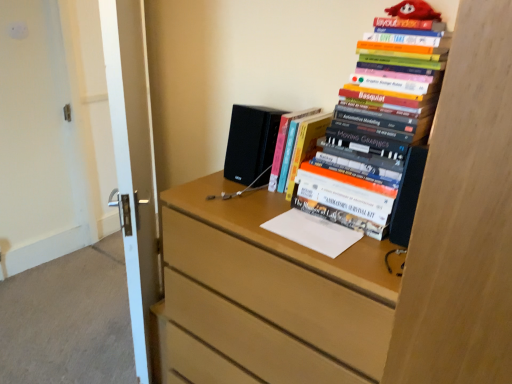
What do you see at coordinates (306, 274) in the screenshot? I see `light wood chest of drawers at center` at bounding box center [306, 274].

Image resolution: width=512 pixels, height=384 pixels. I want to click on hardcover book at center, placed as the second book when sorted from right to left, so click(x=296, y=146).

Based on the photo, measure the distance between point (303, 196) and camera.

1.24 meters.

Locate an element on the screen. The height and width of the screenshot is (384, 512). light wood chest of drawers at center is located at coordinates (306, 274).

Between point (293, 139) and point (151, 163), which one is positioned in front?

The point (293, 139) is closer.

From the image's perspective, is hardcover book at center, placed as the 1th book when sorted from left to right, under white glossy door at left?

No, from the image's perspective, hardcover book at center, placed as the 1th book when sorted from left to right, is not beneath white glossy door at left.

Is hardcover book at center, placed as the 1th book when sorted from left to right, positioned with its back to white glossy door at left?

No, white glossy door at left is not at the back of hardcover book at center, placed as the 1th book when sorted from left to right.

How many degrees apart are the facing directions of hardcover book at center, placed as the second book when sorted from right to left, and white glossy door at left?

44 degrees separate the facing orientations of hardcover book at center, placed as the second book when sorted from right to left, and white glossy door at left.

The width and height of the screenshot is (512, 384). Identify the location of chest of drawers that appears on the right of white glossy door at left. (306, 274).

Is white glossy door at left aimed at light wood chest of drawers at center?

No, white glossy door at left is not facing towards light wood chest of drawers at center.

Between white glossy door at left and light wood chest of drawers at center, which one is positioned in front?

light wood chest of drawers at center is in front.

Considering the sizes of objects black matte speaker at center and hardcover books at upper right, the second book viewed from the left, in the image provided, who is smaller, black matte speaker at center or hardcover books at upper right, the second book viewed from the left,?

black matte speaker at center.

Is there a large distance between black matte speaker at center and hardcover books at upper right, the 1th book from the right?

No, black matte speaker at center is not far away from hardcover books at upper right, the 1th book from the right.

Is the depth of black matte speaker at center less than that of hardcover books at upper right, the second book viewed from the left?

No, it is not.

Find the location of a particular element. This screenshot has height=384, width=512. speaker that appears below the hardcover books at upper right, the second book viewed from the left (from a real-world perspective) is located at coordinates (251, 142).

Can you see hardcover books at upper right, the 1th book from the right, touching hardcover book at center, placed as the second book when sorted from right to left?

No, hardcover books at upper right, the 1th book from the right, is not making contact with hardcover book at center, placed as the second book when sorted from right to left.

Which of these two, hardcover books at upper right, the second book viewed from the left, or hardcover book at center, placed as the second book when sorted from right to left, is bigger?

With larger size is hardcover books at upper right, the second book viewed from the left.

Considering the relative sizes of hardcover books at upper right, the second book viewed from the left, and hardcover book at center, placed as the second book when sorted from right to left, in the image provided, is hardcover books at upper right, the second book viewed from the left, wider than hardcover book at center, placed as the second book when sorted from right to left,?

Yes, hardcover books at upper right, the second book viewed from the left, is wider than hardcover book at center, placed as the second book when sorted from right to left.

Considering the points (145, 73) and (307, 145), which point is in front, point (145, 73) or point (307, 145)?

The point (307, 145) is more forward.

Relative to hardcover book at center, placed as the second book when sorted from right to left, is white glossy door at left in front or behind?

Clearly, white glossy door at left is in front of hardcover book at center, placed as the second book when sorted from right to left.

From the image's perspective, would you say white glossy door at left is positioned over hardcover book at center, placed as the second book when sorted from right to left?

Incorrect, from the image's perspective, white glossy door at left is lower than hardcover book at center, placed as the second book when sorted from right to left.

Locate an element on the screen. book that appears behind the white glossy door at left is located at coordinates (296, 146).

In the image, is hardcover books at upper right, the second book viewed from the left, on the left side or the right side of light wood chest of drawers at center?

From the image, it's evident that hardcover books at upper right, the second book viewed from the left, is to the right of light wood chest of drawers at center.

In the scene shown: Is hardcover books at upper right, the second book viewed from the left, oriented away from light wood chest of drawers at center?

No, hardcover books at upper right, the second book viewed from the left,'s orientation is not away from light wood chest of drawers at center.

Is hardcover books at upper right, the second book viewed from the left, inside or outside of light wood chest of drawers at center?

hardcover books at upper right, the second book viewed from the left, cannot be found inside light wood chest of drawers at center.

Are hardcover books at upper right, the 1th book from the right, and light wood chest of drawers at center far apart?

No, hardcover books at upper right, the 1th book from the right, is in close proximity to light wood chest of drawers at center.

Which of these two, black matte speaker at center or hardcover book at center, placed as the 1th book when sorted from left to right, is thinner?

black matte speaker at center is thinner.

Is black matte speaker at center aimed at hardcover book at center, placed as the second book when sorted from right to left?

No, black matte speaker at center is not facing towards hardcover book at center, placed as the second book when sorted from right to left.

Is the depth of black matte speaker at center greater than that of hardcover book at center, placed as the 1th book when sorted from left to right?

Yes.

Is black matte speaker at center next to hardcover book at center, placed as the second book when sorted from right to left, and touching it?

Indeed, black matte speaker at center and hardcover book at center, placed as the second book when sorted from right to left, are beside each other and touching.

Locate an element on the screen. book behind the white glossy door at left is located at coordinates pyautogui.click(x=296, y=146).

Where is `chest of drawers below the white glossy door at left (from a real-world perspective)`? Image resolution: width=512 pixels, height=384 pixels. chest of drawers below the white glossy door at left (from a real-world perspective) is located at coordinates (306, 274).

When comparing their distances from white glossy door at left, does hardcover books at upper right, the 1th book from the right, or light wood chest of drawers at center seem further?

hardcover books at upper right, the 1th book from the right, is further to white glossy door at left.

Considering their positions, is light wood chest of drawers at center positioned further to hardcover books at upper right, the second book viewed from the left, than black matte speaker at center?

black matte speaker at center is further to hardcover books at upper right, the second book viewed from the left.

Looking at this image, which object lies nearer to the anchor point hardcover book at center, placed as the second book when sorted from right to left, hardcover books at upper right, the second book viewed from the left, or black matte speaker at center?

The object closer to hardcover book at center, placed as the second book when sorted from right to left, is black matte speaker at center.

Looking at the image, which one is located closer to hardcover books at upper right, the 1th book from the right, black matte speaker at center or white glossy door at left?

black matte speaker at center is positioned closer to the anchor hardcover books at upper right, the 1th book from the right.

From the image, which object appears to be nearer to hardcover books at upper right, the second book viewed from the left, white glossy door at left or black matte speaker at center?

Based on the image, black matte speaker at center appears to be nearer to hardcover books at upper right, the second book viewed from the left.

From the image, which object appears to be farther from hardcover books at upper right, the second book viewed from the left, light wood chest of drawers at center or hardcover book at center, placed as the 1th book when sorted from left to right?

light wood chest of drawers at center is positioned further to the anchor hardcover books at upper right, the second book viewed from the left.

Which object lies nearer to the anchor point black matte speaker at center, hardcover books at upper right, the second book viewed from the left, or white glossy door at left?

hardcover books at upper right, the second book viewed from the left, is closer to black matte speaker at center.

Considering their positions, is white glossy door at left positioned closer to hardcover book at center, placed as the 1th book when sorted from left to right, than light wood chest of drawers at center?

Based on the image, light wood chest of drawers at center appears to be nearer to hardcover book at center, placed as the 1th book when sorted from left to right.

Find the location of a particular element. speaker between white glossy door at left and hardcover book at center, placed as the 1th book when sorted from left to right, in the horizontal direction is located at coordinates (251, 142).

Find the location of a particular element. The width and height of the screenshot is (512, 384). door between black matte speaker at center and light wood chest of drawers at center in the vertical direction is located at coordinates (133, 162).

You are a GUI agent. You are given a task and a screenshot of the screen. Output one action in this format:
    pyautogui.click(x=<x>, y=<y>)
    Task: Click on the book between hardcover books at upper right, the second book viewed from the left, and light wood chest of drawers at center from top to bottom
    
    Given the screenshot: What is the action you would take?
    pyautogui.click(x=296, y=146)

Locate an element on the screen. This screenshot has height=384, width=512. book situated between white glossy door at left and hardcover books at upper right, the second book viewed from the left, from left to right is located at coordinates (296, 146).